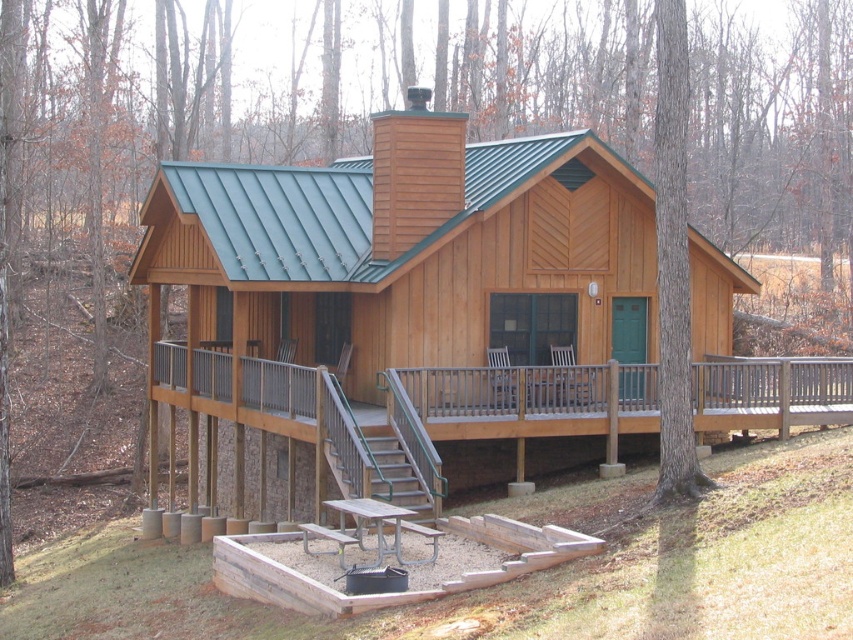
Does brown wooden porch at lower center come in front of metallic gray stairs at center?

Yes, brown wooden porch at lower center is closer to the viewer.

Can you confirm if brown wooden porch at lower center is taller than metallic gray stairs at center?

Yes, brown wooden porch at lower center is taller than metallic gray stairs at center.

Describe the element at coordinates (512, 410) in the screenshot. I see `brown wooden porch at lower center` at that location.

Where is `brown wooden porch at lower center`? brown wooden porch at lower center is located at coordinates (512, 410).